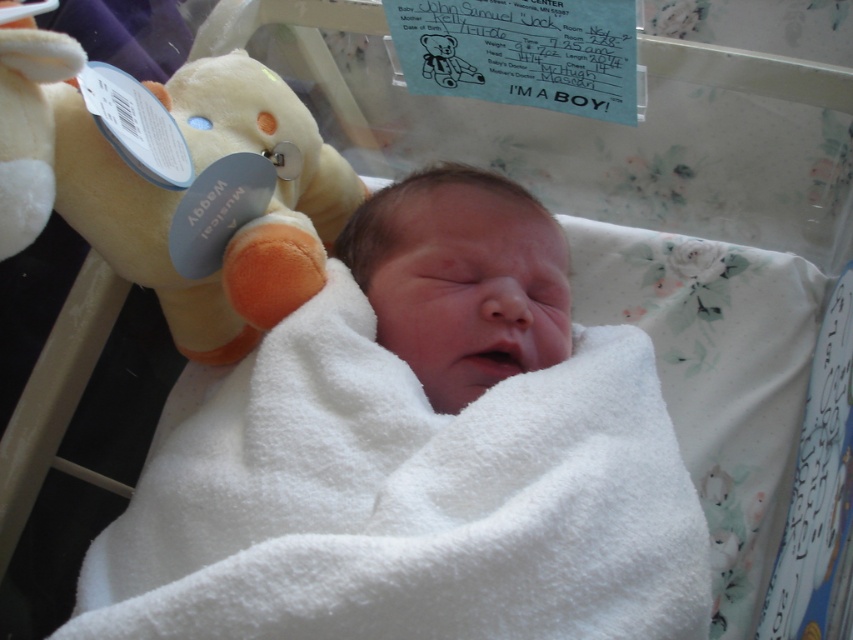
You are a nurse in the hospital room. You need to retrieve the soft plush bear at upper left for a moment. Based on its location coordinates, can you confirm if it is positioned to the left of the bassinet?

The soft plush bear at upper left is located at point (180, 196), which is to the left of the bassinet.

You are a nurse in a hospital nursery. You need to place the soft plush bear at upper left and the smooth white newborn at center into a storage bin. The bin can only fit items smaller than the newborn. Which item should you place first to ensure both fit?

The soft plush bear at upper left is larger than the smooth white newborn at center. Therefore, you should place the smooth white newborn at center first, then the soft plush bear at upper left, but since the bin can only fit items smaller than the newborn, the soft plush bear at upper left cannot be placed in the bin as it is larger.

You are a nurse in a hospital nursery. You need to place a pacifier on the bassinet. The pacifier is small enough to fit anywhere. Where should you place it so that it is not under the soft plush bear at upper left or the smooth white newborn at center?

The pacifier should be placed in an area of the bassinet that is not under the soft plush bear at upper left or the smooth white newborn at center. Since the soft plush bear at upper left is above the smooth white newborn at center, placing the pacifier below the newborn would ensure it is not under either object.